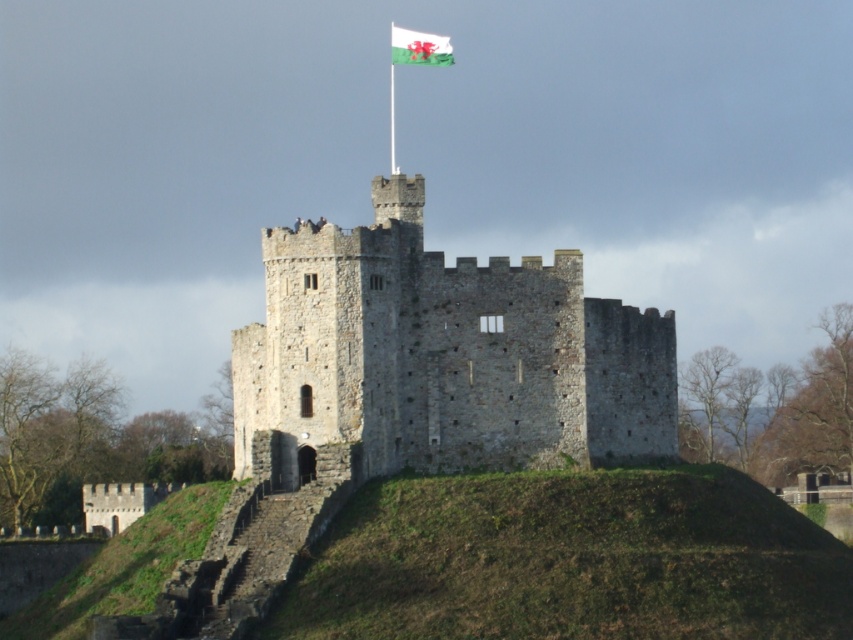
Question: Does stone castle at center appear over green metallic pole at upper center?

Choices:
 (A) yes
 (B) no

Answer: (B)

Question: Which of the following is the farthest from the observer?

Choices:
 (A) (515, 449)
 (B) (390, 84)

Answer: (B)

Question: Which object is the closest to the white fabric flag at top?

Choices:
 (A) green metallic pole at upper center
 (B) stone castle at center

Answer: (A)

Question: Can you confirm if stone castle at center is positioned to the left of white fabric flag at top?

Choices:
 (A) yes
 (B) no

Answer: (B)

Question: Which point is closer to the camera?

Choices:
 (A) pos(636,346)
 (B) pos(426,51)

Answer: (A)

Question: Is stone castle at center wider than green metallic pole at upper center?

Choices:
 (A) no
 (B) yes

Answer: (B)